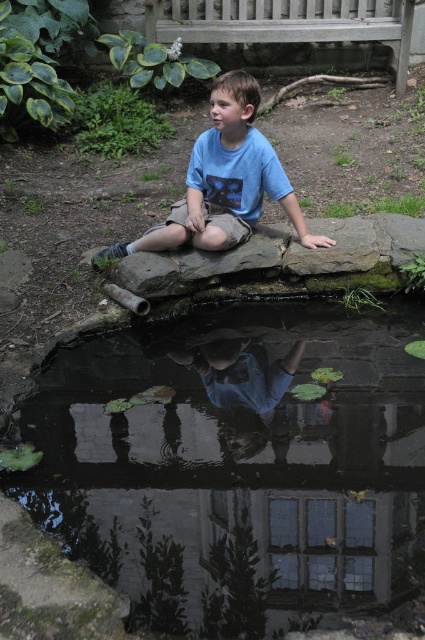
Is transparent water at center further to the viewer compared to wooden bench at upper center?

No, it is in front of wooden bench at upper center.

Does transparent water at center have a greater width compared to wooden bench at upper center?

No, transparent water at center is not wider than wooden bench at upper center.

Which is in front, point (87, 557) or point (401, 51)?

Point (87, 557) is more forward.

Where is `transparent water at center`? This screenshot has width=425, height=640. transparent water at center is located at coordinates (240, 460).

Between blue cotton shirt at center and wooden bench at upper center, which one has less height?

Standing shorter between the two is wooden bench at upper center.

Describe the element at coordinates (223, 180) in the screenshot. The height and width of the screenshot is (640, 425). I see `blue cotton shirt at center` at that location.

This screenshot has width=425, height=640. I want to click on blue cotton shirt at center, so 223,180.

Does transparent water at center have a lesser height compared to blue cotton shirt at center?

Incorrect, transparent water at center's height does not fall short of blue cotton shirt at center's.

Measure the distance between point [397,378] and camera.

The distance of point [397,378] from camera is 3.41 meters.

This screenshot has height=640, width=425. Find the location of `transparent water at center`. transparent water at center is located at coordinates (240, 460).